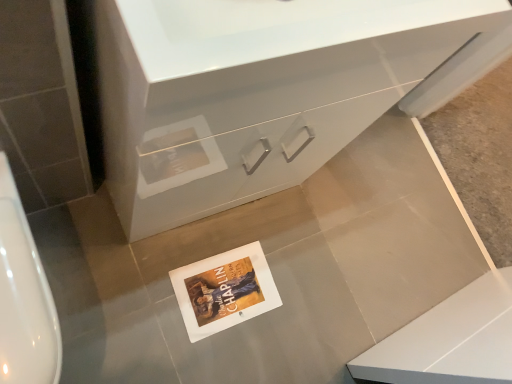
Find the location of a particular element. The height and width of the screenshot is (384, 512). free spot to the left of white paper postcard at center is located at coordinates (166, 251).